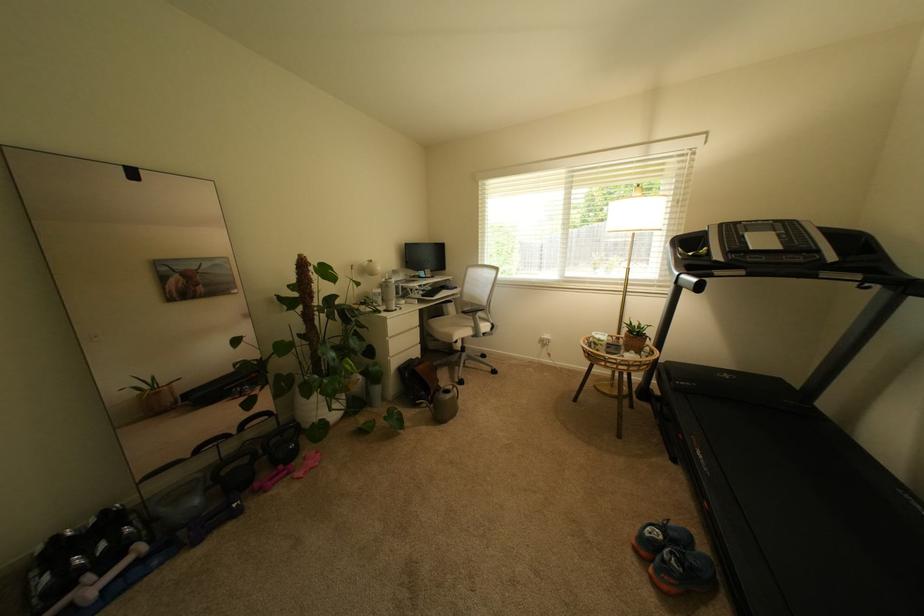
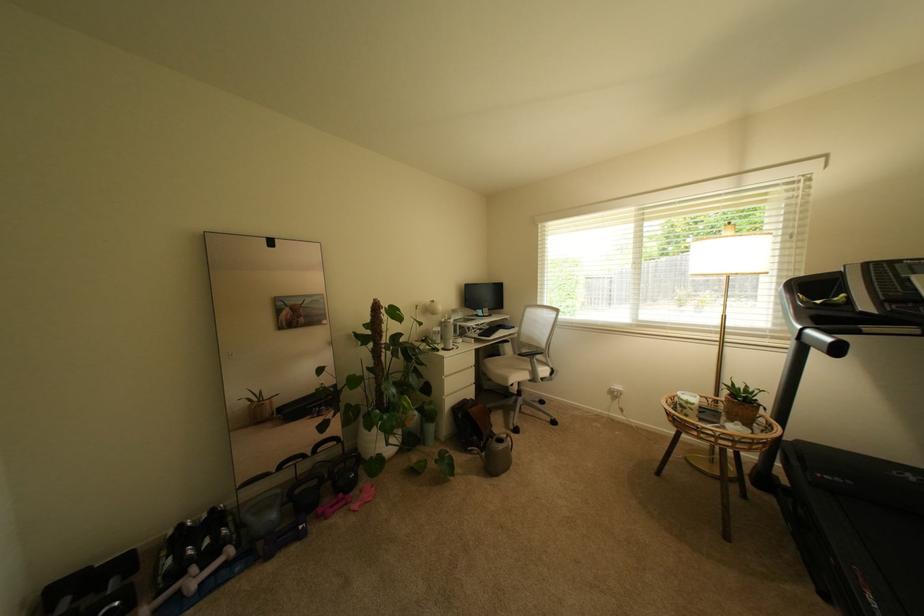
The point at (x=466, y=353) is marked in the first image. Where is the corresponding point in the second image?

(521, 395)